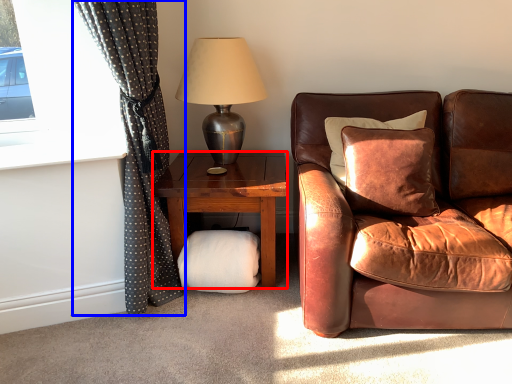
Question: Among these objects, which one is farthest to the camera, studio couch (highlighted by a red box) or curtain (highlighted by a blue box)?

Choices:
 (A) studio couch
 (B) curtain

Answer: (A)